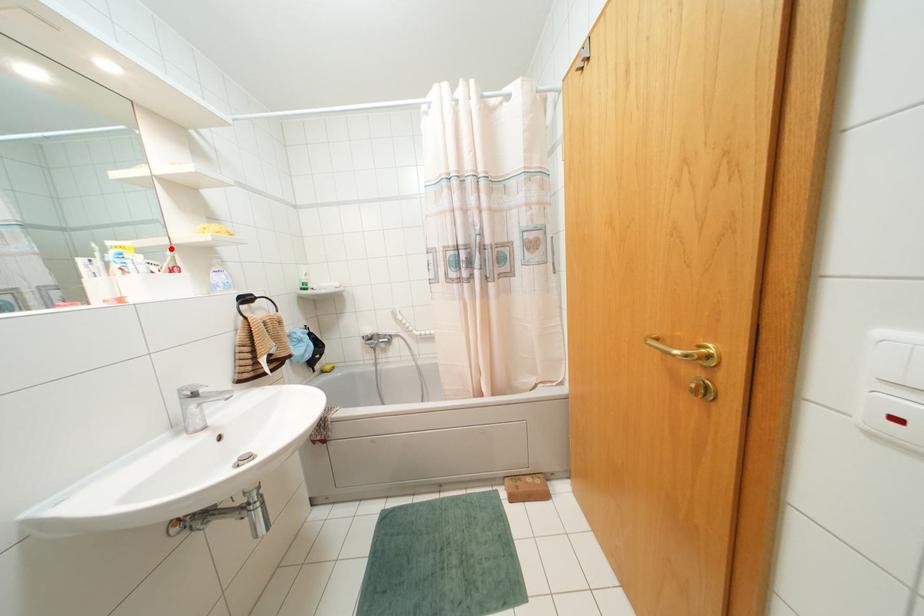
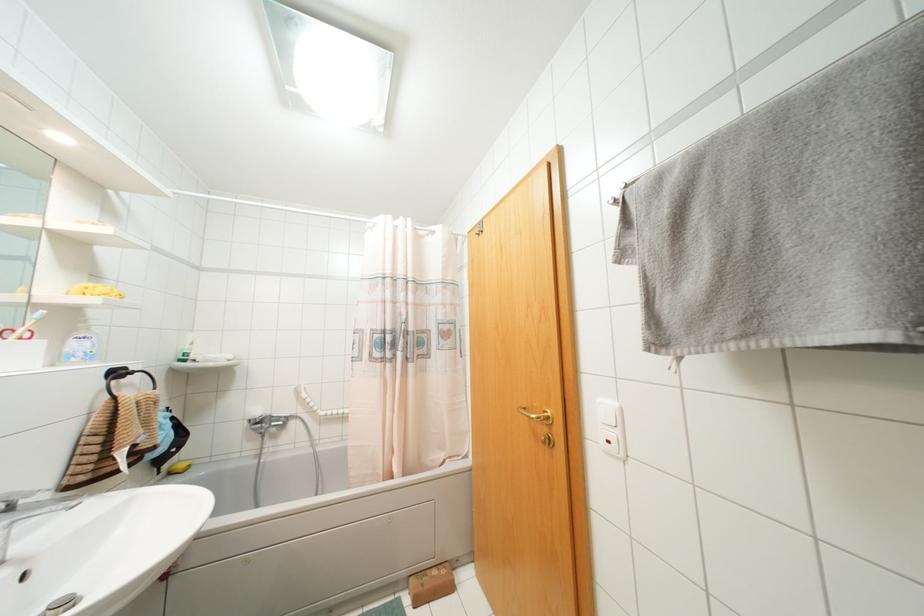
The point at the highlighted location is marked in the first image. Where is the corresponding point in the second image?

(42, 310)